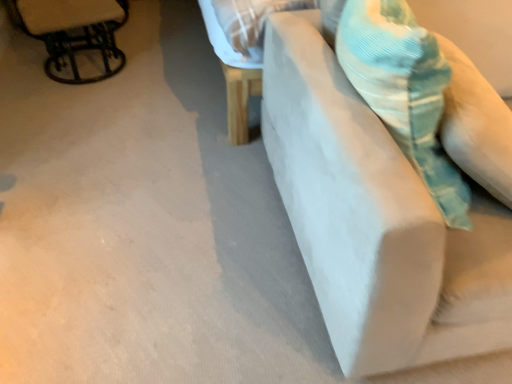
Question: Are corduroy teal throw pillow at upper right and metallic black chair at upper left making contact?

Choices:
 (A) yes
 (B) no

Answer: (B)

Question: Would you say corduroy teal throw pillow at upper right is outside metallic black chair at upper left?

Choices:
 (A) no
 (B) yes

Answer: (B)

Question: Is corduroy teal throw pillow at upper right smaller than metallic black chair at upper left?

Choices:
 (A) no
 (B) yes

Answer: (A)

Question: Considering the relative sizes of corduroy teal throw pillow at upper right and metallic black chair at upper left in the image provided, is corduroy teal throw pillow at upper right taller than metallic black chair at upper left?

Choices:
 (A) yes
 (B) no

Answer: (A)

Question: Is corduroy teal throw pillow at upper right positioned behind metallic black chair at upper left?

Choices:
 (A) no
 (B) yes

Answer: (A)

Question: Is metallic black chair at upper left inside or outside of white fabric couch at right?

Choices:
 (A) outside
 (B) inside

Answer: (A)

Question: From a real-world perspective, is metallic black chair at upper left positioned above or below white fabric couch at right?

Choices:
 (A) below
 (B) above

Answer: (A)

Question: In the image, is metallic black chair at upper left on the left side or the right side of white fabric couch at right?

Choices:
 (A) right
 (B) left

Answer: (B)

Question: In the image, is metallic black chair at upper left positioned in front of or behind white fabric couch at right?

Choices:
 (A) behind
 (B) front

Answer: (A)

Question: Considering the positions of corduroy teal throw pillow at upper right and metallic black chair at upper left in the image, is corduroy teal throw pillow at upper right taller or shorter than metallic black chair at upper left?

Choices:
 (A) short
 (B) tall

Answer: (B)

Question: Considering the positions of point (413, 100) and point (60, 18), is point (413, 100) closer or farther from the camera than point (60, 18)?

Choices:
 (A) farther
 (B) closer

Answer: (B)

Question: Which is correct: corduroy teal throw pillow at upper right is inside metallic black chair at upper left, or outside of it?

Choices:
 (A) outside
 (B) inside

Answer: (A)

Question: Considering the positions of corduroy teal throw pillow at upper right and metallic black chair at upper left in the image, is corduroy teal throw pillow at upper right bigger or smaller than metallic black chair at upper left?

Choices:
 (A) big
 (B) small

Answer: (A)

Question: Based on their positions, is corduroy teal throw pillow at upper right located to the left or right of white fabric couch at right?

Choices:
 (A) right
 (B) left

Answer: (B)

Question: From a real-world perspective, is corduroy teal throw pillow at upper right physically located above or below white fabric couch at right?

Choices:
 (A) below
 (B) above

Answer: (B)